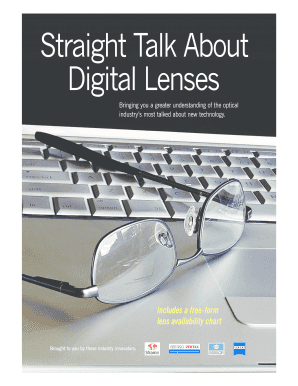
Find the location of a particular element. laptop is located at coordinates (107, 329).